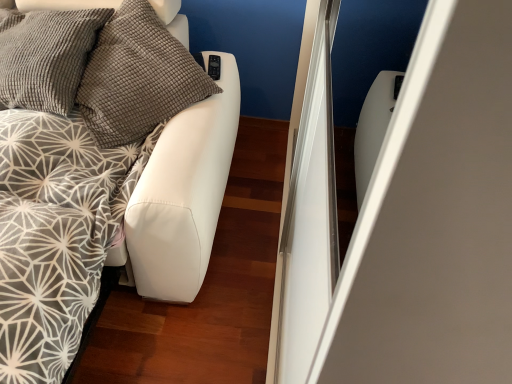
Question: From the image's perspective, is white leather bed at left located above or below textured gray pillow at upper left?

Choices:
 (A) below
 (B) above

Answer: (A)

Question: From a real-world perspective, is white leather bed at left physically located above or below textured gray pillow at upper left?

Choices:
 (A) below
 (B) above

Answer: (A)

Question: Relative to textured gray pillow at upper left, is white leather bed at left in front or behind?

Choices:
 (A) behind
 (B) front

Answer: (B)

Question: Considering the positions of point (200, 72) and point (186, 135), is point (200, 72) closer or farther from the camera than point (186, 135)?

Choices:
 (A) farther
 (B) closer

Answer: (A)

Question: From a real-world perspective, relative to white leather bed at left, is textured gray pillow at upper left vertically above or below?

Choices:
 (A) above
 (B) below

Answer: (A)

Question: Looking at the image, does textured gray pillow at upper left seem bigger or smaller compared to white leather bed at left?

Choices:
 (A) small
 (B) big

Answer: (A)

Question: Would you say textured gray pillow at upper left is inside or outside white leather bed at left?

Choices:
 (A) inside
 (B) outside

Answer: (A)